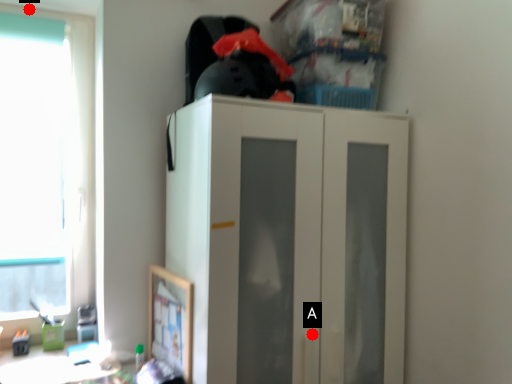
Question: Two points are circled on the image, labeled by A and B beside each circle. Among these points, which one is farthest from the camera?

Choices:
 (A) A is further
 (B) B is further

Answer: (B)